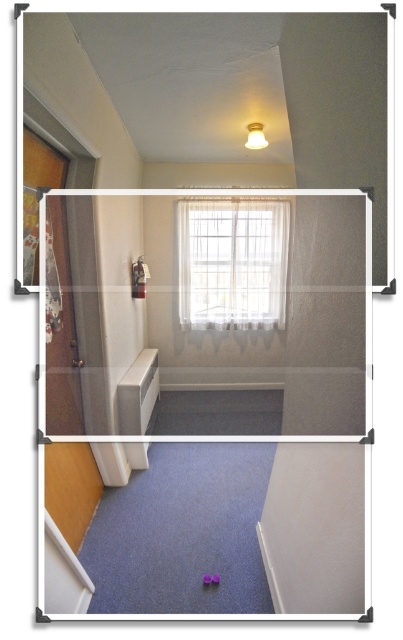
Does sheer white curtain at center have a greater height compared to purple rubber toy at lower center?

Correct, sheer white curtain at center is much taller as purple rubber toy at lower center.

Does point (247, 243) come closer to viewer compared to point (213, 576)?

No, it is behind (213, 576).

The height and width of the screenshot is (640, 403). Identify the location of sheer white curtain at center. (232, 262).

Between matte purple toy at center and purple rubber toy at lower center, which one has more height?

matte purple toy at center

Does matte purple toy at center have a lesser width compared to purple rubber toy at lower center?

No.

At what (x,y) coordinates should I click in order to perform the action: click on matte purple toy at center. Please return your answer as a coordinate pair (x, y). The width and height of the screenshot is (403, 640). Looking at the image, I should click on (207, 579).

Who is lower down, sheer white curtain at center or matte purple toy at center?

matte purple toy at center is below.

Between sheer white curtain at center and matte purple toy at center, which one has more height?

sheer white curtain at center

Where is `sheer white curtain at center`? sheer white curtain at center is located at coordinates (232, 262).